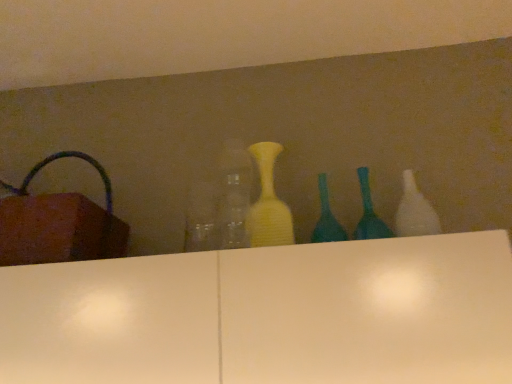
Measure the distance between point (318, 175) and camera.

Point (318, 175) and camera are 4.45 feet apart.

The width and height of the screenshot is (512, 384). What do you see at coordinates (326, 218) in the screenshot? I see `teal glass bottle at center, which is the 3th bottle in right-to-left order` at bounding box center [326, 218].

Describe the element at coordinates (369, 213) in the screenshot. The image size is (512, 384). I see `teal glass bottle at center, which ranks as the fourth bottle in left-to-right order` at that location.

In order to click on teal glass bottle at center, which ranks as the fourth bottle in left-to-right order in this screenshot , I will do pyautogui.click(x=369, y=213).

Locate an element on the screen. The image size is (512, 384). yellow matte vase at center, arranged as the 2th bottle when viewed from the left is located at coordinates (268, 203).

The image size is (512, 384). In order to click on teal glass bottle at center, which is the 3th bottle in right-to-left order in this screenshot , I will do `click(326, 218)`.

Which of these two, teal glass bottle at center, placed as the second bottle when sorted from right to left, or transparent glass bottle at center, which is the fifth bottle from right to left, is wider?

transparent glass bottle at center, which is the fifth bottle from right to left.

Is teal glass bottle at center, which ranks as the fourth bottle in left-to-right order, positioned far away from transparent glass bottle at center, which is the fifth bottle from right to left?

teal glass bottle at center, which ranks as the fourth bottle in left-to-right order, is actually quite close to transparent glass bottle at center, which is the fifth bottle from right to left.

From a real-world perspective, between teal glass bottle at center, which ranks as the fourth bottle in left-to-right order, and transparent glass bottle at center, which appears as the 1th bottle when viewed from the left, who is vertically lower?

teal glass bottle at center, which ranks as the fourth bottle in left-to-right order, is physically lower.

Locate an element on the screen. The image size is (512, 384). bottle that is the 1st one when counting upward from the teal glass bottle at center, which ranks as the fourth bottle in left-to-right order (from the image's perspective) is located at coordinates (234, 194).

Considering the sizes of objects white glossy bottle at right, arranged as the 1th bottle when viewed from the right, and teal glass bottle at center, placed as the second bottle when sorted from right to left, in the image provided, who is shorter, white glossy bottle at right, arranged as the 1th bottle when viewed from the right, or teal glass bottle at center, placed as the second bottle when sorted from right to left,?

teal glass bottle at center, placed as the second bottle when sorted from right to left.

Can you confirm if white glossy bottle at right, arranged as the 1th bottle when viewed from the right, is bigger than teal glass bottle at center, which ranks as the fourth bottle in left-to-right order?

Yes.

Is white glossy bottle at right, arranged as the 1th bottle when viewed from the right, facing towards teal glass bottle at center, which ranks as the fourth bottle in left-to-right order?

No.

From the image's perspective, which one is positioned higher, white glossy bottle at right, arranged as the 1th bottle when viewed from the right, or teal glass bottle at center, which ranks as the fourth bottle in left-to-right order?

From the image's view, white glossy bottle at right, arranged as the 1th bottle when viewed from the right, is above.

Could you tell me if white glossy bottle at right, which is counted as the fifth bottle, starting from the left, is turned towards yellow matte vase at center, arranged as the 2th bottle when viewed from the left?

No, white glossy bottle at right, which is counted as the fifth bottle, starting from the left, is not turned towards yellow matte vase at center, arranged as the 2th bottle when viewed from the left.

From a real-world perspective, starting from the yellow matte vase at center, arranged as the 2th bottle when viewed from the left, which bottle is the 3rd one below it? Please provide its 2D coordinates.

[(415, 211)]

From the image's perspective, which object appears higher, white glossy bottle at right, which is counted as the fifth bottle, starting from the left, or yellow matte vase at center, the 4th bottle when ordered from right to left?

yellow matte vase at center, the 4th bottle when ordered from right to left, is shown above in the image.

Considering the sizes of objects white glossy bottle at right, which is counted as the fifth bottle, starting from the left, and yellow matte vase at center, the 4th bottle when ordered from right to left, in the image provided, who is smaller, white glossy bottle at right, which is counted as the fifth bottle, starting from the left, or yellow matte vase at center, the 4th bottle when ordered from right to left,?

white glossy bottle at right, which is counted as the fifth bottle, starting from the left, is smaller.

Is teal glass bottle at center, the 3th bottle when ordered from left to right, taller or shorter than transparent glass bottle at center, which appears as the 1th bottle when viewed from the left?

teal glass bottle at center, the 3th bottle when ordered from left to right, is shorter than transparent glass bottle at center, which appears as the 1th bottle when viewed from the left.

Is teal glass bottle at center, which is the 3th bottle in right-to-left order, touching transparent glass bottle at center, which appears as the 1th bottle when viewed from the left?

No, teal glass bottle at center, which is the 3th bottle in right-to-left order, is not next to transparent glass bottle at center, which appears as the 1th bottle when viewed from the left.

Can you tell me how much teal glass bottle at center, which is the 3th bottle in right-to-left order, and transparent glass bottle at center, which is the fifth bottle from right to left, differ in facing direction?

The angular difference between teal glass bottle at center, which is the 3th bottle in right-to-left order, and transparent glass bottle at center, which is the fifth bottle from right to left, is 0.00571 degrees.

This screenshot has width=512, height=384. Identify the location of the 1st bottle behind the teal glass bottle at center, which is the 3th bottle in right-to-left order. (369, 213).

Measure the distance from teal glass bottle at center, which ranks as the fourth bottle in left-to-right order, to teal glass bottle at center, which is the 3th bottle in right-to-left order.

They are 3.49 inches apart.

From a real-world perspective, is teal glass bottle at center, which ranks as the fourth bottle in left-to-right order, physically below teal glass bottle at center, the 3th bottle when ordered from left to right?

Actually, teal glass bottle at center, which ranks as the fourth bottle in left-to-right order, is physically above teal glass bottle at center, the 3th bottle when ordered from left to right, in the real world.

Is teal glass bottle at center, which ranks as the fourth bottle in left-to-right order, positioned far away from teal glass bottle at center, which is the 3th bottle in right-to-left order?

No.

Measure the distance from teal glass bottle at center, which ranks as the fourth bottle in left-to-right order, to white glossy bottle at right, which is counted as the fifth bottle, starting from the left.

The distance of teal glass bottle at center, which ranks as the fourth bottle in left-to-right order, from white glossy bottle at right, which is counted as the fifth bottle, starting from the left, is 9.65 centimeters.

From the image's perspective, who appears lower, teal glass bottle at center, which ranks as the fourth bottle in left-to-right order, or white glossy bottle at right, which is counted as the fifth bottle, starting from the left?

From the image's view, teal glass bottle at center, which ranks as the fourth bottle in left-to-right order, is below.

From a real-world perspective, is teal glass bottle at center, placed as the second bottle when sorted from right to left, physically above white glossy bottle at right, which is counted as the fifth bottle, starting from the left?

Indeed, from a real-world perspective, teal glass bottle at center, placed as the second bottle when sorted from right to left, stands above white glossy bottle at right, which is counted as the fifth bottle, starting from the left.

Which of these two, teal glass bottle at center, which ranks as the fourth bottle in left-to-right order, or white glossy bottle at right, arranged as the 1th bottle when viewed from the right, is bigger?

Bigger between the two is white glossy bottle at right, arranged as the 1th bottle when viewed from the right.

Is white glossy bottle at right, arranged as the 1th bottle when viewed from the right, bigger than transparent glass bottle at center, which appears as the 1th bottle when viewed from the left?

No, white glossy bottle at right, arranged as the 1th bottle when viewed from the right, is not bigger than transparent glass bottle at center, which appears as the 1th bottle when viewed from the left.

Considering the relative positions of white glossy bottle at right, arranged as the 1th bottle when viewed from the right, and transparent glass bottle at center, which is the fifth bottle from right to left, in the image provided, is white glossy bottle at right, arranged as the 1th bottle when viewed from the right, behind transparent glass bottle at center, which is the fifth bottle from right to left,?

That is True.

How many degrees apart are the facing directions of white glossy bottle at right, arranged as the 1th bottle when viewed from the right, and transparent glass bottle at center, which is the fifth bottle from right to left?

The facing directions of white glossy bottle at right, arranged as the 1th bottle when viewed from the right, and transparent glass bottle at center, which is the fifth bottle from right to left, are 0.00999 degrees apart.

Choose the correct answer: Is white glossy bottle at right, which is counted as the fifth bottle, starting from the left, inside transparent glass bottle at center, which appears as the 1th bottle when viewed from the left, or outside it?

white glossy bottle at right, which is counted as the fifth bottle, starting from the left, is not inside transparent glass bottle at center, which appears as the 1th bottle when viewed from the left, it's outside.

This screenshot has width=512, height=384. I want to click on the 3rd bottle to the right when counting from the transparent glass bottle at center, which appears as the 1th bottle when viewed from the left, so click(x=369, y=213).

From the image's perspective, count 2nd bottles downward from the white glossy bottle at right, which is counted as the fifth bottle, starting from the left, and point to it. Please provide its 2D coordinates.

[(369, 213)]

Estimate the real-world distances between objects in this image. Which object is further from teal glass bottle at center, which ranks as the fourth bottle in left-to-right order, teal glass bottle at center, the 3th bottle when ordered from left to right, or yellow matte vase at center, the 4th bottle when ordered from right to left?

Based on the image, yellow matte vase at center, the 4th bottle when ordered from right to left, appears to be further to teal glass bottle at center, which ranks as the fourth bottle in left-to-right order.

Considering their positions, is white glossy bottle at right, arranged as the 1th bottle when viewed from the right, positioned further to yellow matte vase at center, arranged as the 2th bottle when viewed from the left, than teal glass bottle at center, which ranks as the fourth bottle in left-to-right order?

Based on the image, white glossy bottle at right, arranged as the 1th bottle when viewed from the right, appears to be further to yellow matte vase at center, arranged as the 2th bottle when viewed from the left.

Looking at the image, which one is located further to teal glass bottle at center, the 3th bottle when ordered from left to right, teal glass bottle at center, which ranks as the fourth bottle in left-to-right order, or transparent glass bottle at center, which is the fifth bottle from right to left?

The object further to teal glass bottle at center, the 3th bottle when ordered from left to right, is transparent glass bottle at center, which is the fifth bottle from right to left.

Based on their spatial positions, is teal glass bottle at center, placed as the second bottle when sorted from right to left, or transparent glass bottle at center, which appears as the 1th bottle when viewed from the left, further from yellow matte vase at center, the 4th bottle when ordered from right to left?

teal glass bottle at center, placed as the second bottle when sorted from right to left, lies further to yellow matte vase at center, the 4th bottle when ordered from right to left, than the other object.

Estimate the real-world distances between objects in this image. Which object is further from teal glass bottle at center, which ranks as the fourth bottle in left-to-right order, transparent glass bottle at center, which appears as the 1th bottle when viewed from the left, or teal glass bottle at center, the 3th bottle when ordered from left to right?

Based on the image, transparent glass bottle at center, which appears as the 1th bottle when viewed from the left, appears to be further to teal glass bottle at center, which ranks as the fourth bottle in left-to-right order.

Which object lies nearer to the anchor point white glossy bottle at right, which is counted as the fifth bottle, starting from the left, teal glass bottle at center, which ranks as the fourth bottle in left-to-right order, or teal glass bottle at center, which is the 3th bottle in right-to-left order?

The object closer to white glossy bottle at right, which is counted as the fifth bottle, starting from the left, is teal glass bottle at center, which ranks as the fourth bottle in left-to-right order.

From the image, which object appears to be nearer to white glossy bottle at right, which is counted as the fifth bottle, starting from the left, yellow matte vase at center, the 4th bottle when ordered from right to left, or transparent glass bottle at center, which is the fifth bottle from right to left?

Based on the image, yellow matte vase at center, the 4th bottle when ordered from right to left, appears to be nearer to white glossy bottle at right, which is counted as the fifth bottle, starting from the left.

Based on their spatial positions, is white glossy bottle at right, which is counted as the fifth bottle, starting from the left, or teal glass bottle at center, the 3th bottle when ordered from left to right, further from yellow matte vase at center, arranged as the 2th bottle when viewed from the left?

The object further to yellow matte vase at center, arranged as the 2th bottle when viewed from the left, is white glossy bottle at right, which is counted as the fifth bottle, starting from the left.

The width and height of the screenshot is (512, 384). I want to click on bottle between teal glass bottle at center, which is the 3th bottle in right-to-left order, and white glossy bottle at right, which is counted as the fifth bottle, starting from the left, in the horizontal direction, so click(369, 213).

Locate an element on the screen. This screenshot has width=512, height=384. bottle between yellow matte vase at center, arranged as the 2th bottle when viewed from the left, and teal glass bottle at center, placed as the second bottle when sorted from right to left is located at coordinates (326, 218).

Identify the location of bottle between transparent glass bottle at center, which is the fifth bottle from right to left, and teal glass bottle at center, the 3th bottle when ordered from left to right. (268, 203).